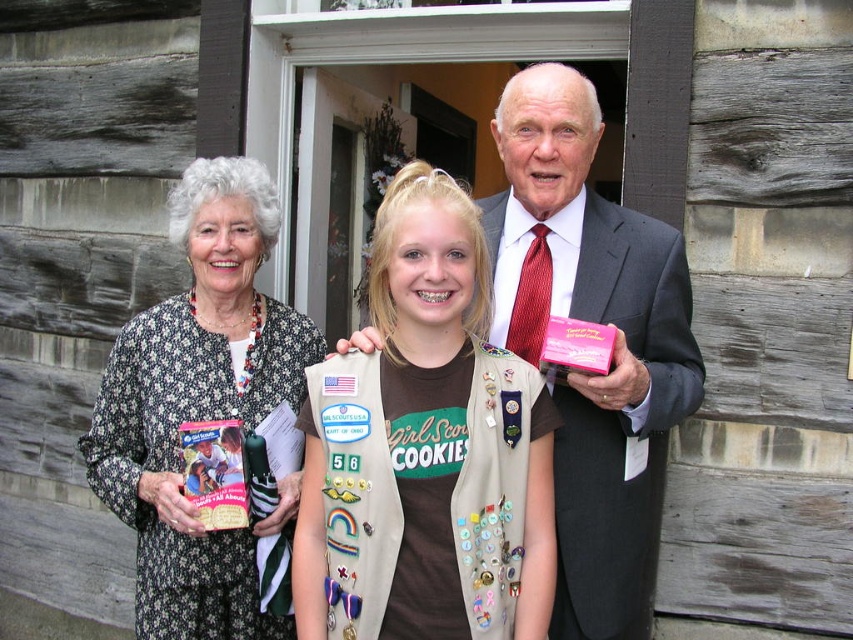
Does dark gray suit at center lie behind floral-patterned dress at left?

No, it is in front of floral-patterned dress at left.

The image size is (853, 640). What do you see at coordinates (613, 348) in the screenshot?
I see `dark gray suit at center` at bounding box center [613, 348].

This screenshot has width=853, height=640. I want to click on dark gray suit at center, so click(x=613, y=348).

Can you confirm if tan girl scout vest at center is bigger than floral-patterned dress at left?

Incorrect, tan girl scout vest at center is not larger than floral-patterned dress at left.

Is tan girl scout vest at center in front of floral-patterned dress at left?

Yes, tan girl scout vest at center is closer to the viewer.

Does point (477, 596) come farther from viewer compared to point (173, 572)?

No.

This screenshot has height=640, width=853. I want to click on tan girl scout vest at center, so click(427, 449).

Is tan girl scout vest at center bigger than dark gray suit at center?

No, tan girl scout vest at center is not bigger than dark gray suit at center.

Which is behind, point (520, 502) or point (486, 204)?

The point (486, 204) is more distant.

Is point (456, 461) behind point (556, 476)?

No, it is in front of (556, 476).

Locate an element on the screen. The width and height of the screenshot is (853, 640). tan girl scout vest at center is located at coordinates [427, 449].